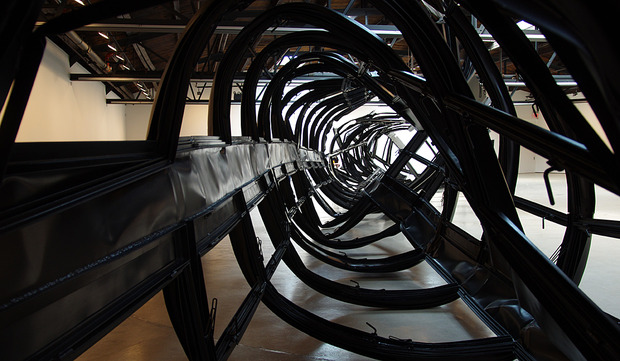
Locate an element on the screen. The width and height of the screenshot is (620, 361). ceiling is located at coordinates (100, 47).